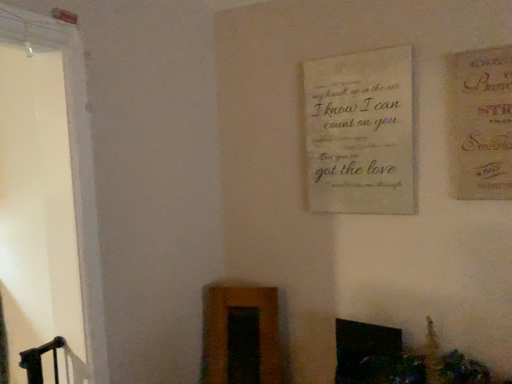
Question: From the image's perspective, is off-white fabric plaque at center under matte beige postcard at upper right?

Choices:
 (A) yes
 (B) no

Answer: (A)

Question: Does off-white fabric plaque at center lie in front of matte beige postcard at upper right?

Choices:
 (A) yes
 (B) no

Answer: (B)

Question: Would you say matte beige postcard at upper right is part of off-white fabric plaque at center's contents?

Choices:
 (A) no
 (B) yes

Answer: (A)

Question: Does off-white fabric plaque at center have a greater height compared to matte beige postcard at upper right?

Choices:
 (A) no
 (B) yes

Answer: (B)

Question: Does off-white fabric plaque at center have a smaller size compared to matte beige postcard at upper right?

Choices:
 (A) no
 (B) yes

Answer: (A)

Question: From their relative heights in the image, would you say matte beige postcard at upper right is taller or shorter than off-white fabric plaque at center?

Choices:
 (A) short
 (B) tall

Answer: (A)

Question: Looking at their shapes, would you say matte beige postcard at upper right is wider or thinner than off-white fabric plaque at center?

Choices:
 (A) thin
 (B) wide

Answer: (B)

Question: Is matte beige postcard at upper right to the left or to the right of off-white fabric plaque at center in the image?

Choices:
 (A) left
 (B) right

Answer: (B)

Question: Is matte beige postcard at upper right in front of or behind off-white fabric plaque at center in the image?

Choices:
 (A) behind
 (B) front

Answer: (B)

Question: From the image's perspective, is off-white fabric plaque at center located above or below matte beige postcard at upper right?

Choices:
 (A) below
 (B) above

Answer: (A)

Question: Is point (336, 122) closer or farther from the camera than point (475, 127)?

Choices:
 (A) closer
 (B) farther

Answer: (B)

Question: Do you think off-white fabric plaque at center is within matte beige postcard at upper right, or outside of it?

Choices:
 (A) inside
 (B) outside

Answer: (B)

Question: In the image, is off-white fabric plaque at center positioned in front of or behind matte beige postcard at upper right?

Choices:
 (A) front
 (B) behind

Answer: (B)

Question: From the image's perspective, relative to matte beige postcard at upper right, is black glossy fireplace at lower center above or below?

Choices:
 (A) above
 (B) below

Answer: (B)

Question: In terms of width, does black glossy fireplace at lower center look wider or thinner when compared to matte beige postcard at upper right?

Choices:
 (A) wide
 (B) thin

Answer: (A)